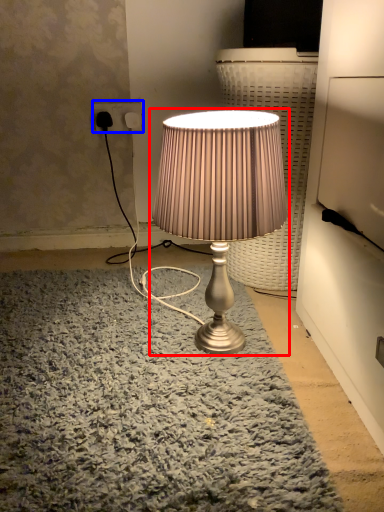
Question: Among these objects, which one is nearest to the camera, lamp (highlighted by a red box) or electric outlet (highlighted by a blue box)?

Choices:
 (A) lamp
 (B) electric outlet

Answer: (A)